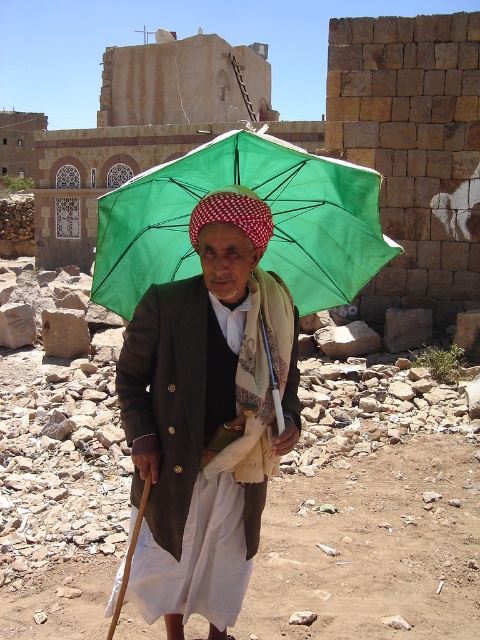
You are a traveler in this arid environment and need to choose between the matte green umbrella at center and the green fabric umbrella at upper center for shade. Which one would provide better shade coverage based on their sizes?

The matte green umbrella at center has a greater height compared to the green fabric umbrella at upper center, so it would provide better shade coverage due to its larger size.

Consider the image. You are an observer in the scene and want to know which umbrella is shorter. You see the matte green umbrella at center and the green fabric umbrella at center. Which one is shorter?

The matte green umbrella at center is shorter than the green fabric umbrella at center.

You are a photographer trying to capture the elderly man and his umbrellas. Since you want to focus on the matte green umbrella at center, which is closer to you, you decide to use a shallow depth of field to blur the background. Would the green fabric umbrella at upper center be blurred in the photo?

Yes, the green fabric umbrella at upper center would be blurred because the matte green umbrella at center is in front of it, so when using a shallow depth of field focusing on the matte green umbrella at center, the background elements like the green fabric umbrella at upper center would be out of focus.